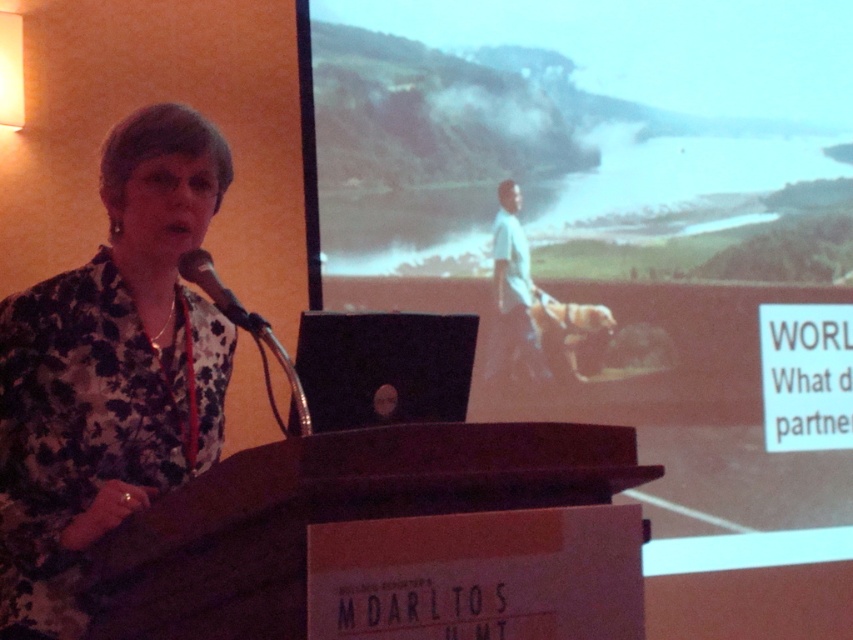
How far apart are black matte laptop at center and matte black microphone at left?

They are 9.12 inches apart.

Describe the element at coordinates (384, 368) in the screenshot. The width and height of the screenshot is (853, 640). I see `black matte laptop at center` at that location.

What are the coordinates of `black matte laptop at center` in the screenshot? It's located at (384, 368).

This screenshot has width=853, height=640. What are the coordinates of `black matte laptop at center` in the screenshot? It's located at (384, 368).

Does floral fabric shirt at left appear over matte black microphone at left?

Actually, floral fabric shirt at left is below matte black microphone at left.

Looking at this image, can you confirm if floral fabric shirt at left is positioned below matte black microphone at left?

Yes, floral fabric shirt at left is below matte black microphone at left.

Locate an element on the screen. Image resolution: width=853 pixels, height=640 pixels. floral fabric shirt at left is located at coordinates (109, 369).

Find the location of a particular element. floral fabric shirt at left is located at coordinates (109, 369).

Looking at this image, is matte black laptop at center in front of matte black microphone at left?

No.

Between matte black laptop at center and matte black microphone at left, which one is positioned lower?

Positioned lower is matte black microphone at left.

Between point (436, 284) and point (184, 275), which one is positioned in front?

Point (184, 275) is in front.

Where is `matte black laptop at center`? matte black laptop at center is located at coordinates (618, 234).